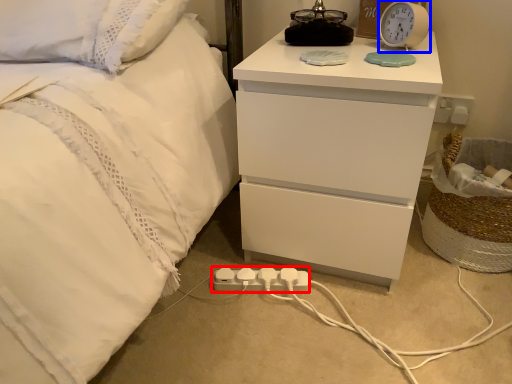
Question: Which object appears closest to the camera in this image, extension cord (highlighted by a red box) or alarm clock (highlighted by a blue box)?

Choices:
 (A) extension cord
 (B) alarm clock

Answer: (B)